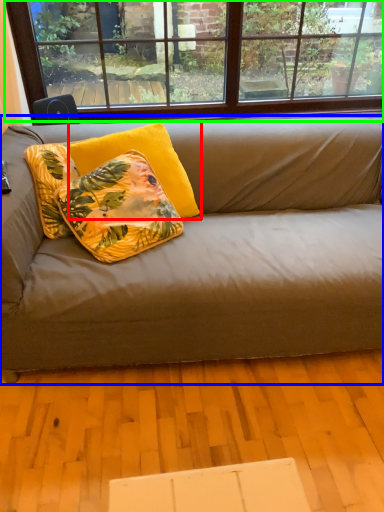
Question: Estimate the real-world distances between objects in this image. Which object is closer to pillow (highlighted by a red box), studio couch (highlighted by a blue box) or window (highlighted by a green box)?

Choices:
 (A) studio couch
 (B) window

Answer: (A)